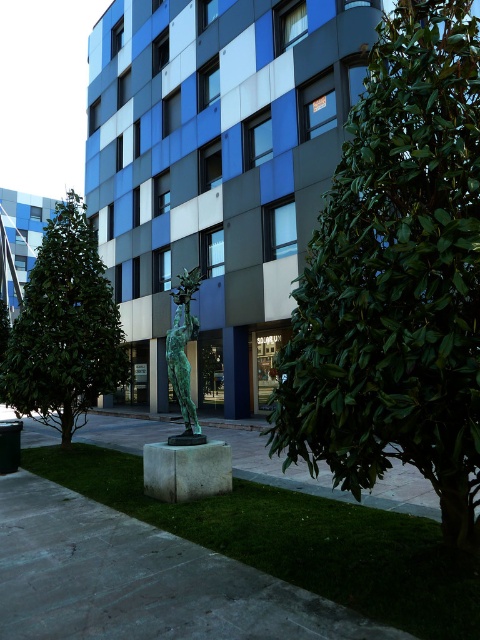
This screenshot has height=640, width=480. What do you see at coordinates (396, 278) in the screenshot?
I see `green leafy tree at right` at bounding box center [396, 278].

Is green leafy tree at right bigger than green bronze statue at center?

Indeed, green leafy tree at right has a larger size compared to green bronze statue at center.

The height and width of the screenshot is (640, 480). Identify the location of green leafy tree at right. (396, 278).

Is green leafy tree at right further to camera compared to green leafy tree at left?

No, it is in front of green leafy tree at left.

Is point (418, 86) farther from viewer compared to point (24, 378)?

No, (418, 86) is in front of (24, 378).

Where is `green leafy tree at right`? This screenshot has height=640, width=480. green leafy tree at right is located at coordinates (396, 278).

Does green leafy tree at left have a greater height compared to green bronze statue at center?

Yes.

Between point (111, 362) and point (199, 268), which one is positioned behind?

The point (199, 268) is more distant.

You are a GUI agent. You are given a task and a screenshot of the screen. Output one action in this format:
    pyautogui.click(x=<x>, y=<y>)
    Task: Click on the green leafy tree at left
    The height and width of the screenshot is (640, 480).
    Given the screenshot: What is the action you would take?
    pyautogui.click(x=64, y=328)